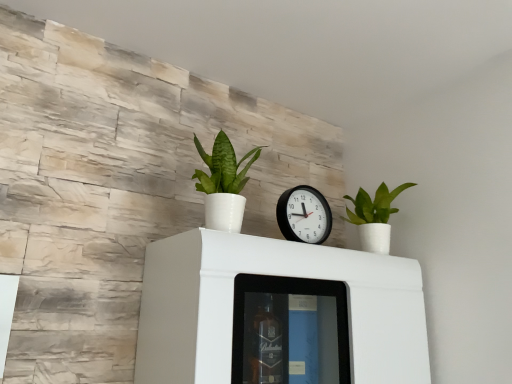
Question: Is white glossy cabinet at center bigger or smaller than green matte plant at upper right, which is counted as the second houseplant, starting from the left?

Choices:
 (A) big
 (B) small

Answer: (A)

Question: From a real-world perspective, is white glossy cabinet at center physically located above or below green matte plant at upper right, which is the 2th houseplant from front to back?

Choices:
 (A) above
 (B) below

Answer: (B)

Question: Estimate the real-world distances between objects in this image. Which object is closer to the green matte plant at upper right, which is the 2th houseplant from front to back?

Choices:
 (A) black plastic wall clock at center
 (B) green glossy plant at center, acting as the 2th houseplant starting from the right
 (C) white glossy cabinet at center

Answer: (A)

Question: Which object is positioned farthest from the green matte plant at upper right, the first houseplant from the back?

Choices:
 (A) black plastic wall clock at center
 (B) green glossy plant at center, acting as the 2th houseplant starting from the right
 (C) white glossy cabinet at center

Answer: (B)